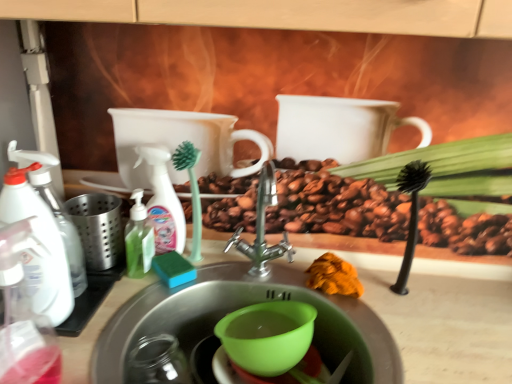
The height and width of the screenshot is (384, 512). What are the coordinates of `free location in front of orange fabric at sink` in the screenshot? It's located at (345, 326).